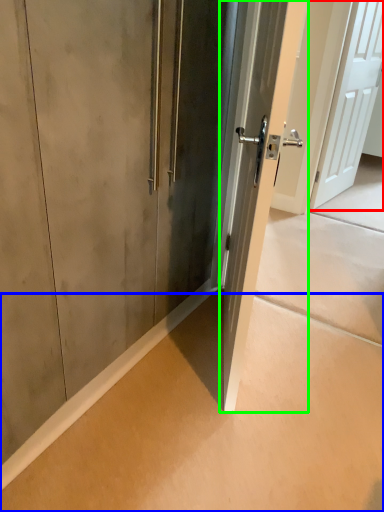
Question: Which is farther away from door (highlighted by a red box)? concrete (highlighted by a blue box) or door (highlighted by a green box)?

Choices:
 (A) concrete
 (B) door

Answer: (A)